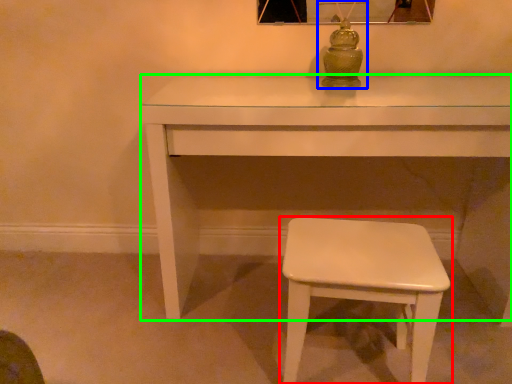
Question: Considering the real-world distances, which object is closest to stool (highlighted by a red box)? table lamp (highlighted by a blue box) or table (highlighted by a green box).

Choices:
 (A) table lamp
 (B) table

Answer: (B)